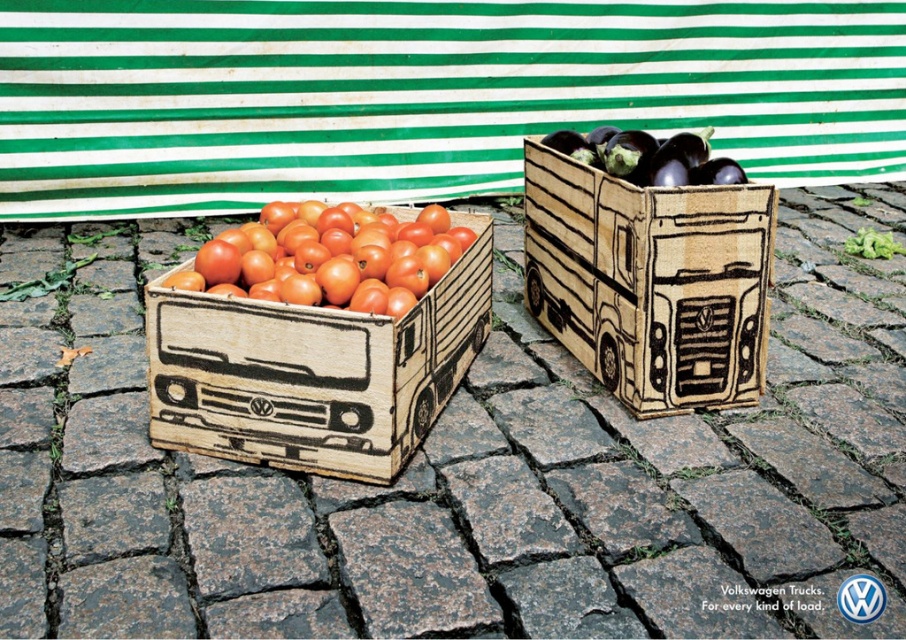
Does wooden crate at center appear under wooden truck at left?

No, wooden crate at center is not below wooden truck at left.

Between point (518, 371) and point (398, 435), which one is positioned behind?

The point (518, 371) is more distant.

The image size is (906, 640). Find the location of `wooden crate at center`. wooden crate at center is located at coordinates (461, 470).

What do you see at coordinates (461, 470) in the screenshot? The image size is (906, 640). I see `wooden crate at center` at bounding box center [461, 470].

Find the location of `wooden crate at center`. wooden crate at center is located at coordinates [461, 470].

Identify the location of wooden crate at center. Image resolution: width=906 pixels, height=640 pixels. (461, 470).

Locate an element on the screen. wooden crate at center is located at coordinates (461, 470).

How much distance is there between wooden crate at center and wooden truck at center?

21.52 inches

Locate an element on the screen. wooden crate at center is located at coordinates (461, 470).